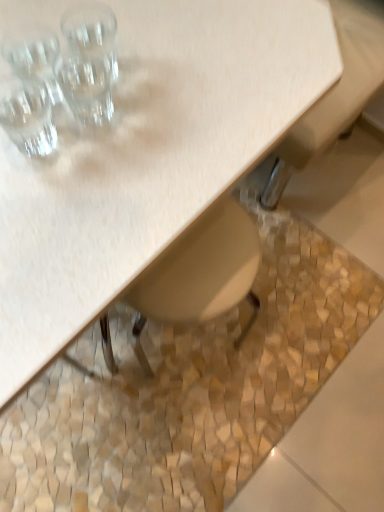
At what (x,y) coordinates should I click in order to perform the action: click on free spot in front of transparent glass at upper left, positioned as the 2th shot glass in bottom-to-top order. Please return your answer as a coordinate pair (x, y). Looking at the image, I should click on (88, 194).